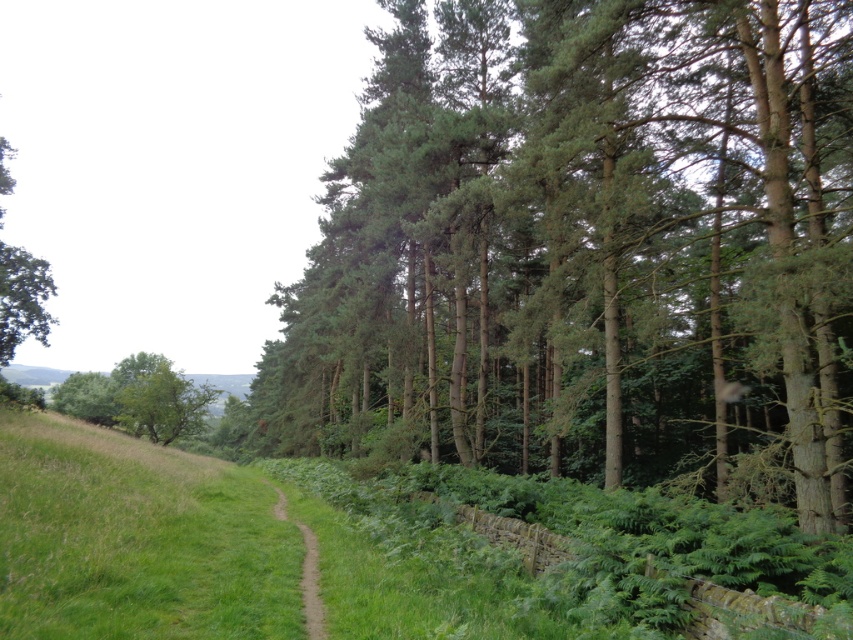
Who is shorter, green textured trees at center or brown dirt path at center?

brown dirt path at center is shorter.

Is point (764, 300) farther from camera compared to point (312, 636)?

Yes, point (764, 300) is farther from viewer.

Who is more distant from viewer, (421, 116) or (323, 616)?

Point (421, 116)

In order to click on green textured trees at center in this screenshot , I will do `click(585, 244)`.